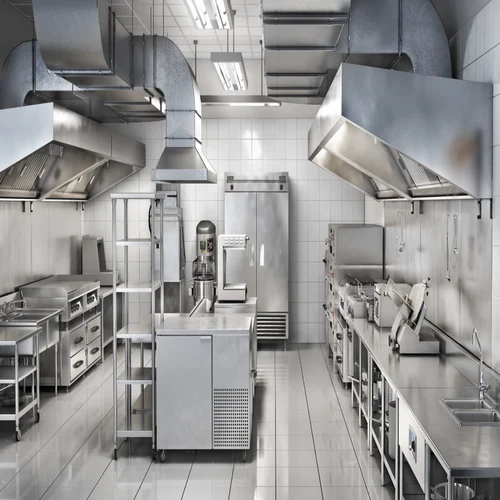
You are a GUI agent. You are given a task and a screenshot of the screen. Output one action in this format:
    pyautogui.click(x=<x>, y=<y>)
    Task: Click on the stainless steel surgace
    This screenshot has height=500, width=500.
    Given the screenshot: What is the action you would take?
    pyautogui.click(x=393, y=377)